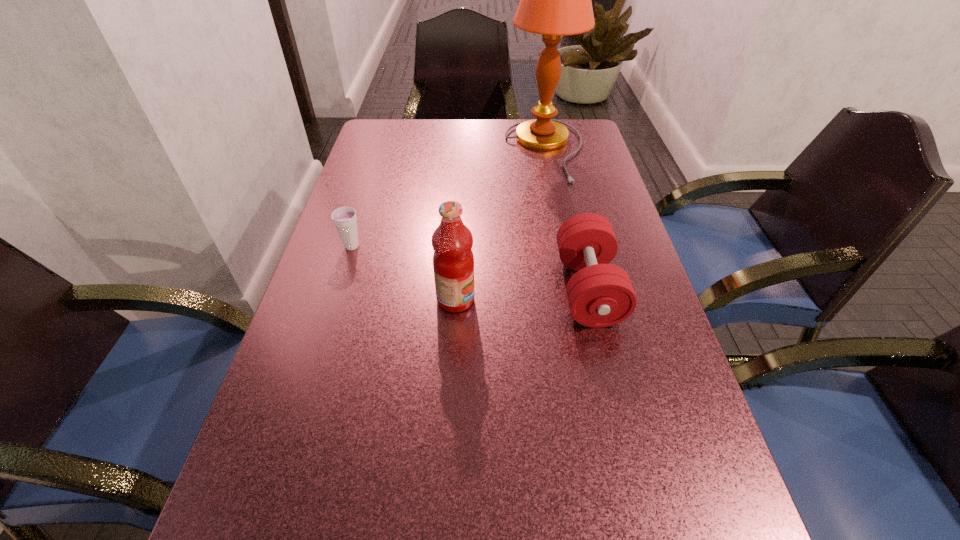
Identify the location of vacant space located 0.330m on the back of the cup. The image size is (960, 540). (376, 168).

This screenshot has width=960, height=540. What are the coordinates of `object that is positioned at the far edge` in the screenshot? It's located at (555, 0).

You are a GUI agent. You are given a task and a screenshot of the screen. Output one action in this format:
    pyautogui.click(x=<x>, y=<y>)
    Task: Click on the object at the left edge
    
    Given the screenshot: What is the action you would take?
    pyautogui.click(x=344, y=218)

You are a GUI agent. You are given a task and a screenshot of the screen. Output one action in this format:
    pyautogui.click(x=<x>, y=<y>)
    Task: Click on the lamp present at the right edge
    The height and width of the screenshot is (540, 960).
    Given the screenshot: What is the action you would take?
    pyautogui.click(x=555, y=0)

Locate an element on the screen. dumbbell present at the right edge is located at coordinates (600, 294).

Identify the location of object present at the far right corner. 555,0.

Identify the location of blank space at the far edge. (459, 120).

In order to click on free point at the left edge in this screenshot , I will do `click(355, 178)`.

Locate an element on the screen. vacant space at the right edge is located at coordinates (591, 162).

At what (x,y) coordinates should I click in order to perform the action: click on vacant point located between the shortest object and the tallest object. Please return your answer as a coordinate pair (x, y). The image size is (960, 540). Looking at the image, I should click on (448, 198).